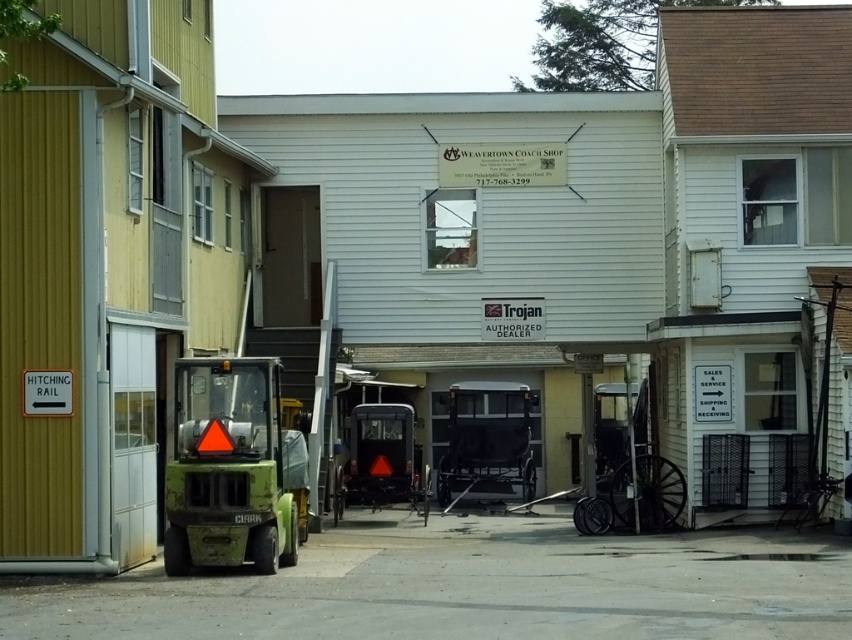
Question: Which point appears closest to the camera in this image?

Choices:
 (A) (513, 416)
 (B) (649, 492)
 (C) (386, 476)
 (D) (243, 452)

Answer: (D)

Question: Which of the following is the farthest from the observer?

Choices:
 (A) (609, 499)
 (B) (471, 451)

Answer: (B)

Question: Does metallic polished buggy at center appear over wooden cart at center?

Choices:
 (A) yes
 (B) no

Answer: (B)

Question: Which point appears farthest from the camera in this image?

Choices:
 (A) (475, 484)
 (B) (188, 515)
 (C) (588, 502)
 (D) (369, 422)

Answer: (A)

Question: Can you confirm if metallic polished buggy at center is positioned below wooden cart at center?

Choices:
 (A) no
 (B) yes

Answer: (B)

Question: Is amber wood cart at center further to the viewer compared to wooden cart at center?

Choices:
 (A) yes
 (B) no

Answer: (A)